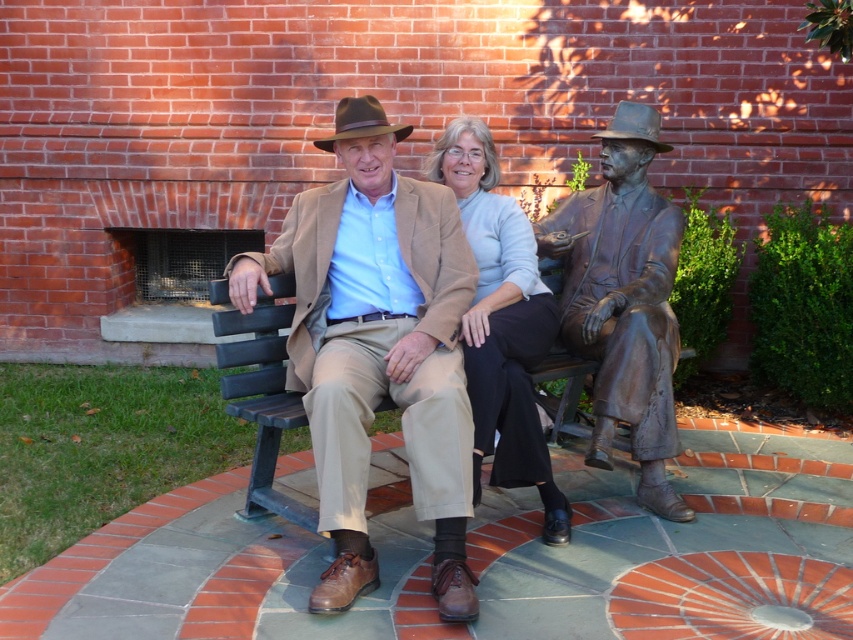
Question: Which object is positioned farthest from the matte beige sweater at center?

Choices:
 (A) wooden bench at center
 (B) bronze statue at right
 (C) brown felt hat at center

Answer: (A)

Question: Can you confirm if matte beige sweater at center is positioned to the right of brown felt hat at center?

Choices:
 (A) yes
 (B) no

Answer: (A)

Question: Estimate the real-world distances between objects in this image. Which object is farther from the wooden bench at center?

Choices:
 (A) brown felt hat at center
 (B) bronze statue at right
 (C) matte beige sweater at center
 (D) matte brown leather jacket at center

Answer: (B)

Question: Is matte brown leather jacket at center below matte beige sweater at center?

Choices:
 (A) no
 (B) yes

Answer: (B)

Question: Which point is closer to the camera taking this photo?

Choices:
 (A) (384, 256)
 (B) (445, 163)

Answer: (A)

Question: Can you confirm if matte beige sweater at center is bigger than shiny bronze cowboy hat at center?

Choices:
 (A) no
 (B) yes

Answer: (B)